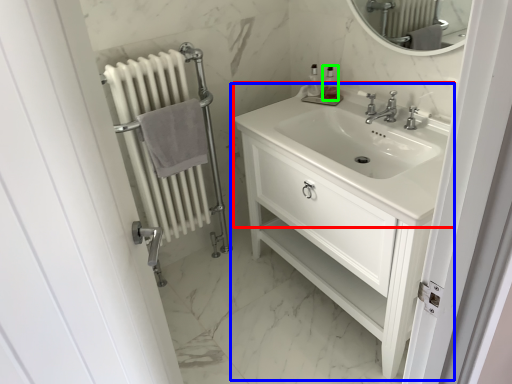
Question: Which object is positioned farthest from sink (highlighted by a red box)? Select from bathroom cabinet (highlighted by a blue box) and soap dispenser (highlighted by a green box).

Choices:
 (A) bathroom cabinet
 (B) soap dispenser

Answer: (B)